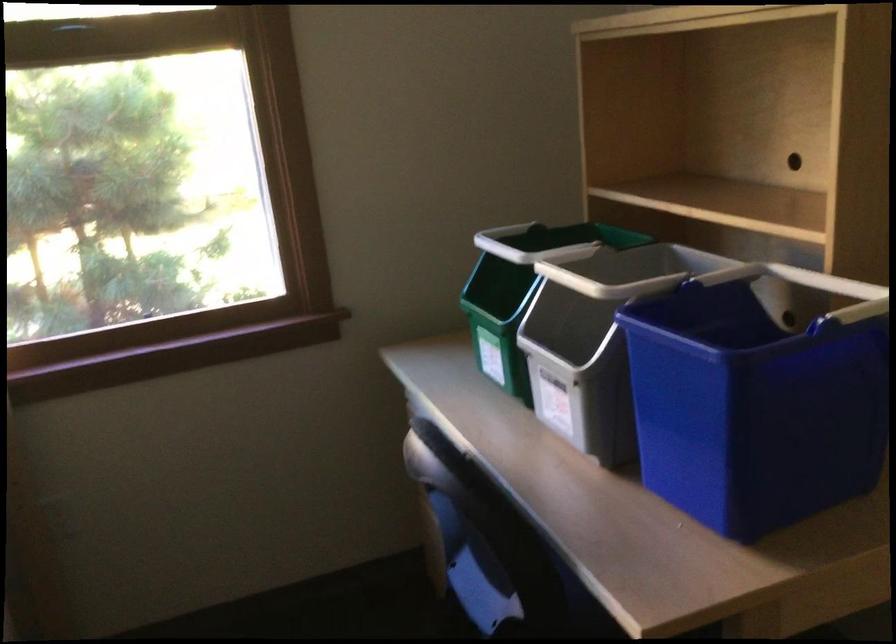
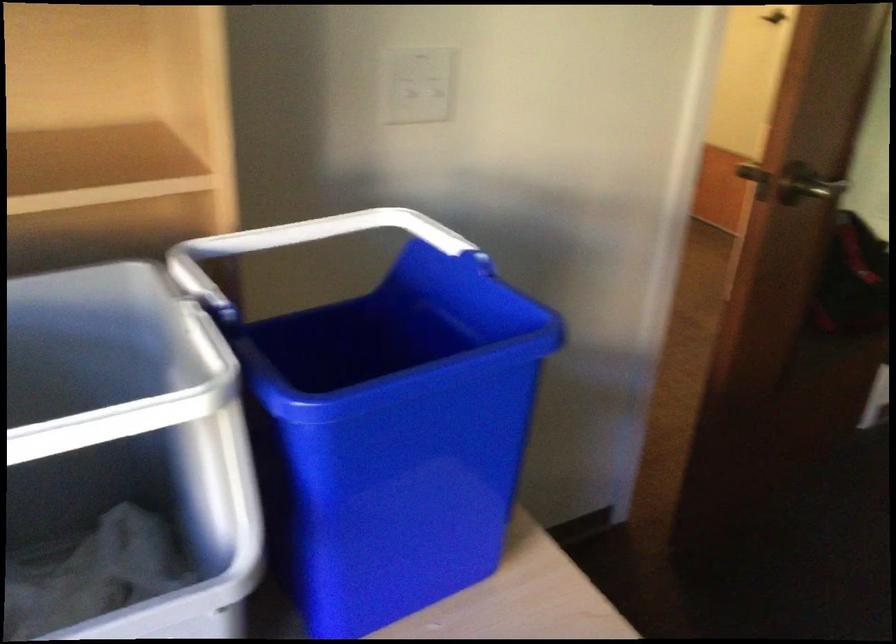
Find the pixel in the second image that matches (782,275) in the first image.

(213, 257)